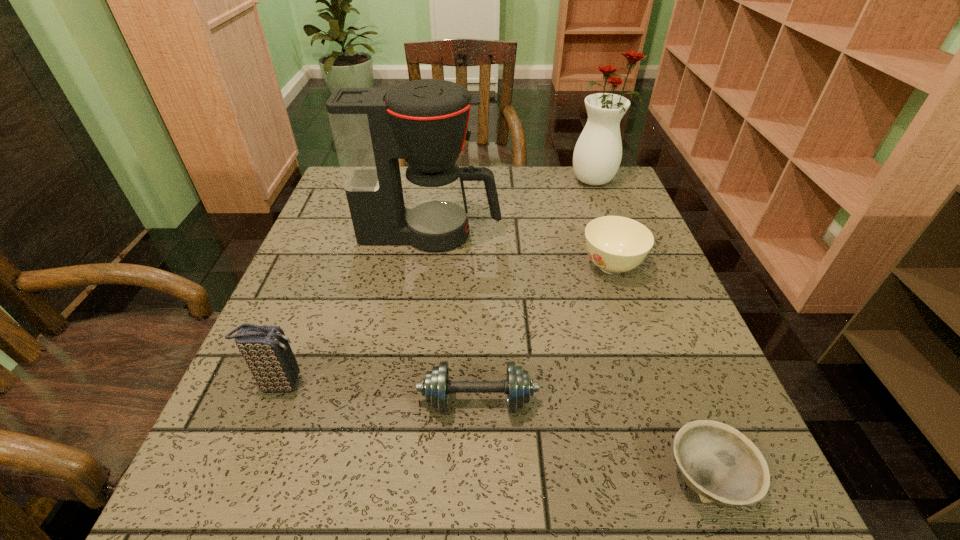
Where is `coffee maker`? This screenshot has width=960, height=540. coffee maker is located at coordinates (425, 122).

This screenshot has width=960, height=540. In order to click on the farthest object in this screenshot , I will do `click(597, 155)`.

Locate an element on the screen. clutch bag is located at coordinates (265, 349).

Where is `the leftmost object`? The image size is (960, 540). the leftmost object is located at coordinates pyautogui.click(x=265, y=349).

This screenshot has height=540, width=960. I want to click on sugar bowl, so click(x=616, y=244).

Where is `dumbbell`? The image size is (960, 540). dumbbell is located at coordinates (436, 386).

Where is `bowl`? The height and width of the screenshot is (540, 960). bowl is located at coordinates (721, 465).

Where is `the shortest object`? This screenshot has width=960, height=540. the shortest object is located at coordinates (721, 465).

At what (x,y) coordinates should I click in order to perform the action: click on vacant area located 0.280m pour from the carafe of the coffee maker. Please return your answer as a coordinate pair (x, y). Image resolution: width=960 pixels, height=540 pixels. Looking at the image, I should click on (614, 234).

Locate an element on the screen. The image size is (960, 540). vacant point located on the front of the vase is located at coordinates (624, 249).